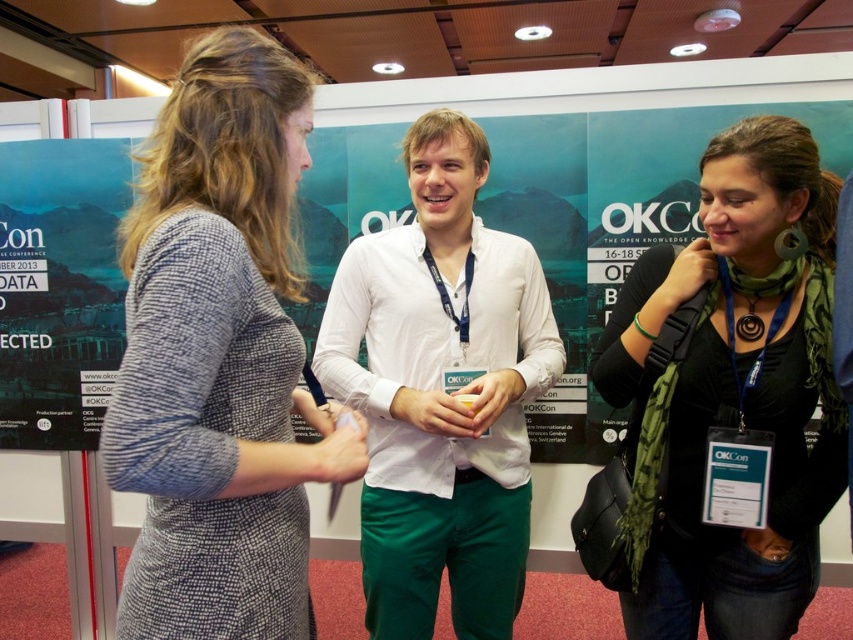
Who is taller, textured gray dress at center or matte black poster at upper left?

Standing taller between the two is matte black poster at upper left.

Does point (195, 419) come behind point (71, 193)?

No.

Locate an element on the screen. The image size is (853, 640). textured gray dress at center is located at coordinates (219, 356).

Is matte black poster at upper left closer to camera compared to matte paper poster at left?

Yes, it is.

Is point (38, 296) closer to camera compared to point (48, 376)?

That is True.

Who is more distant from viewer, (0, 248) or (10, 198)?

The point (0, 248) is more distant.

Locate an element on the screen. The image size is (853, 640). matte black poster at upper left is located at coordinates (608, 225).

Who is taller, textured gray dress at center or matte paper poster at left?

With more height is matte paper poster at left.

Is point (195, 636) farther from viewer compared to point (62, 349)?

That is False.

This screenshot has height=640, width=853. I want to click on textured gray dress at center, so click(x=219, y=356).